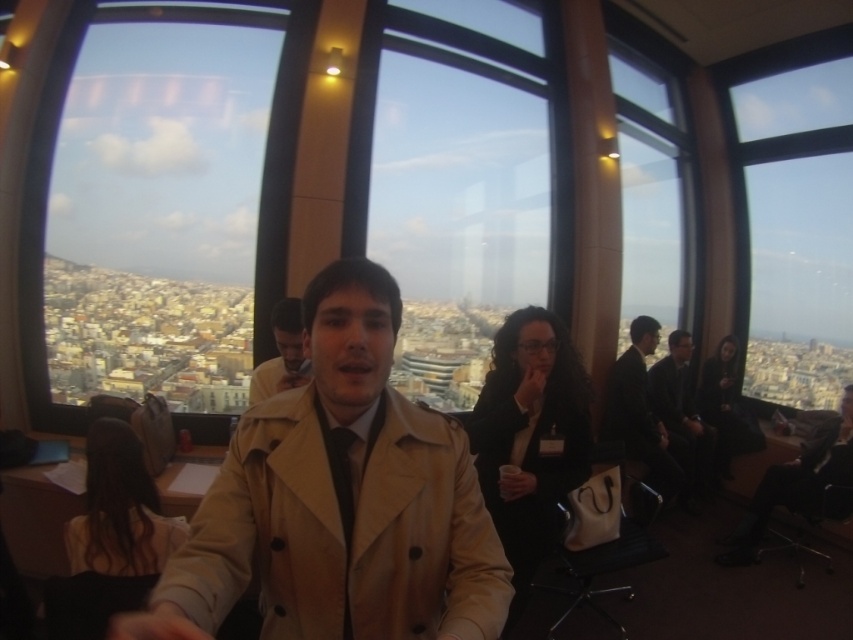
Question: Does beige fabric trench coat at center have a lesser width compared to matte beige coat at center?

Choices:
 (A) no
 (B) yes

Answer: (A)

Question: Which of the following is the closest to the observer?

Choices:
 (A) (128, 166)
 (B) (776, 280)

Answer: (B)

Question: Among these objects, which one is nearest to the camera?

Choices:
 (A) dark suit at center
 (B) dark gray suit at right
 (C) transparent glass window at upper right

Answer: (A)

Question: Can you confirm if transparent glass window at upper right is smaller than dark gray suit at right?

Choices:
 (A) yes
 (B) no

Answer: (B)

Question: Which of the following is the farthest from the observer?

Choices:
 (A) (56, 118)
 (B) (271, 369)
 (C) (416, 529)

Answer: (A)

Question: Is beige fabric trench coat at center above transparent glass window at upper right?

Choices:
 (A) yes
 (B) no

Answer: (B)